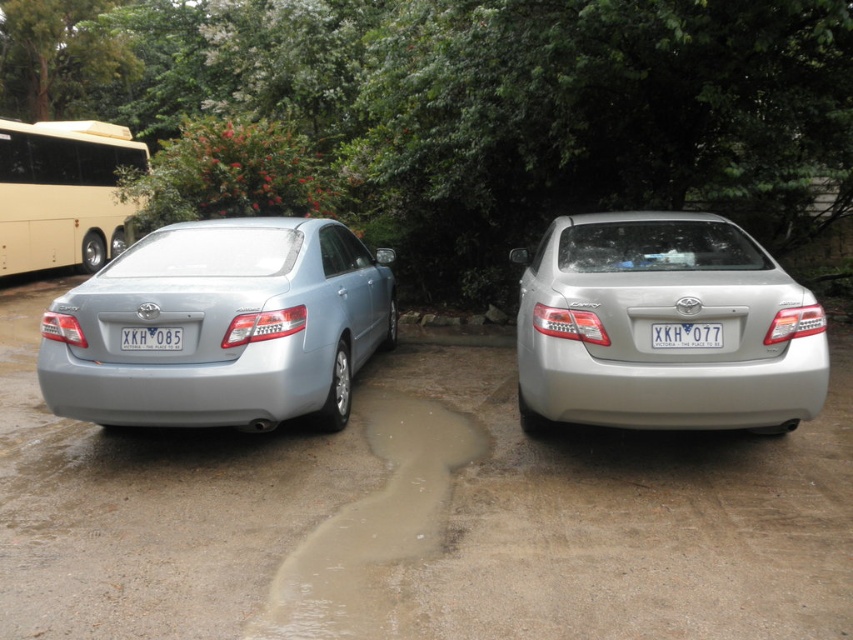
Question: Can you confirm if white plastic license plate at center is wider than white plastic license plate at left?

Choices:
 (A) no
 (B) yes

Answer: (B)

Question: Does satin silver sedan at right have a lesser width compared to beige metallic bus at left?

Choices:
 (A) yes
 (B) no

Answer: (B)

Question: Can you confirm if brown/clay-like puddle at lower center is positioned to the right of white plastic license plate at center?

Choices:
 (A) no
 (B) yes

Answer: (A)

Question: Which of the following is the closest to the observer?

Choices:
 (A) (97, 124)
 (B) (476, 449)
 (C) (366, 264)

Answer: (B)

Question: Which point is closer to the camera?

Choices:
 (A) white plastic license plate at center
 (B) white plastic license plate at left
 (C) brown/clay-like puddle at lower center
 (D) satin silver sedan at left

Answer: (C)

Question: Which of the following is the closest to the observer?

Choices:
 (A) satin silver sedan at right
 (B) beige metallic bus at left
 (C) satin silver sedan at left
 (D) white plastic license plate at left

Answer: (A)